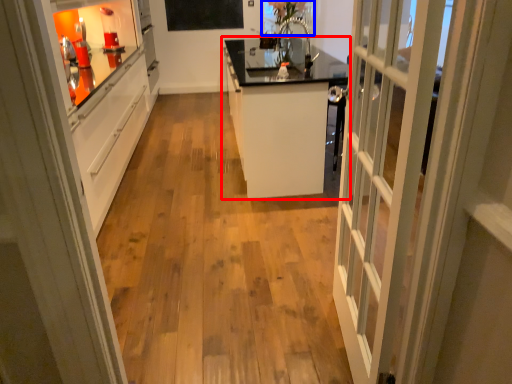
Question: Which object appears farthest to the camera in this image, cabinetry (highlighted by a red box) or window screen (highlighted by a blue box)?

Choices:
 (A) cabinetry
 (B) window screen

Answer: (B)